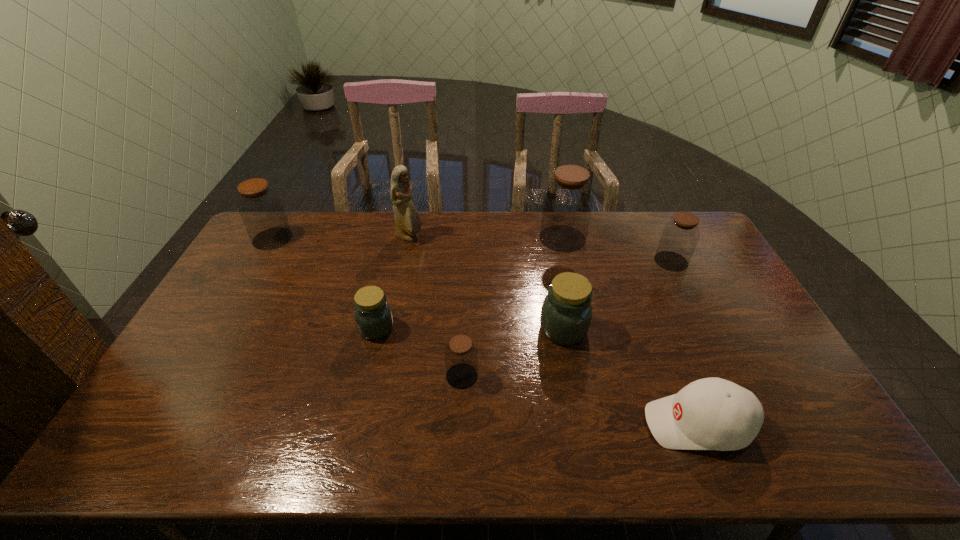
This screenshot has width=960, height=540. I want to click on free point between the fourth object from left to right and the fifth jar from right to left, so click(420, 352).

Select which object appears as the fifth closest to the rightmost jar. Please provide its 2D coordinates. Your answer should be formatted as a tuple, i.e. [(x, y)], where the tuple contains the x and y coordinates of a point satisfying the conditions above.

[(408, 222)]

At what (x,y) coordinates should I click in order to perform the action: click on object identified as the seventh closest to the smaller green jar. Please return your answer as a coordinate pair (x, y). This screenshot has width=960, height=540. Looking at the image, I should click on (679, 238).

Select which jar appears as the second closest to the white baseball cap. Please provide its 2D coordinates. Your answer should be formatted as a tuple, i.e. [(x, y)], where the tuple contains the x and y coordinates of a point satisfying the conditions above.

[(461, 356)]

This screenshot has height=540, width=960. I want to click on jar that is the third closest to the biggest brown jar, so click(461, 356).

Point out which brown jar is positioned as the third nearest to the baseball cap. Please provide its 2D coordinates. Your answer should be formatted as a tuple, i.e. [(x, y)], where the tuple contains the x and y coordinates of a point satisfying the conditions above.

[(568, 200)]

Identify which brown jar is located as the second nearest to the sixth shortest object. Please provide its 2D coordinates. Your answer should be formatted as a tuple, i.e. [(x, y)], where the tuple contains the x and y coordinates of a point satisfying the conditions above.

[(568, 200)]

The image size is (960, 540). What are the coordinates of `vacant space that satisfies the following two spatial constraints: 1. on the back side of the rightmost jar; 2. on the front-facing side of the figurine` in the screenshot? It's located at (660, 238).

At what (x,y) coordinates should I click in order to perform the action: click on free spot that satisfies the following two spatial constraints: 1. on the front-facing side of the figurine; 2. on the front side of the second biggest brown jar. Please return your answer as a coordinate pair (x, y). The width and height of the screenshot is (960, 540). Looking at the image, I should click on (410, 238).

This screenshot has width=960, height=540. I want to click on free spot that satisfies the following two spatial constraints: 1. on the back side of the rightmost brown jar; 2. on the front-facing side of the figurine, so click(660, 238).